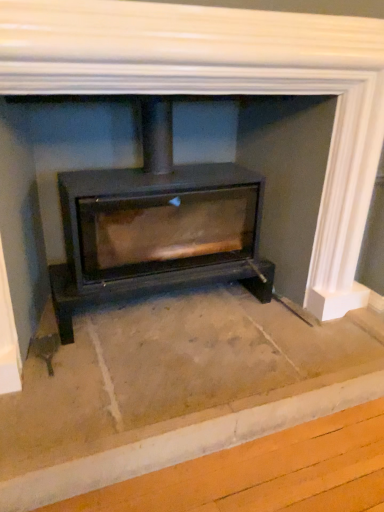
Question: Should I look upward or downward to see matte black wood burning stove at center?

Choices:
 (A) up
 (B) down

Answer: (A)